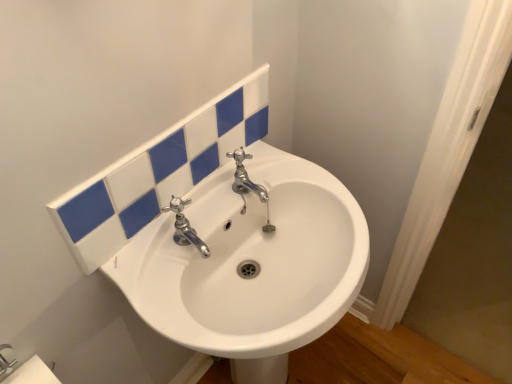
Question: Considering the relative positions of chrome/metallic faucet at center and white matte toilet paper at lower left in the image provided, is chrome/metallic faucet at center behind white matte toilet paper at lower left?

Choices:
 (A) no
 (B) yes

Answer: (B)

Question: Considering the relative sizes of chrome/metallic faucet at center and white matte toilet paper at lower left in the image provided, is chrome/metallic faucet at center smaller than white matte toilet paper at lower left?

Choices:
 (A) yes
 (B) no

Answer: (A)

Question: From the image's perspective, is chrome/metallic faucet at center over white matte toilet paper at lower left?

Choices:
 (A) no
 (B) yes

Answer: (B)

Question: Is chrome/metallic faucet at center positioned far away from white matte toilet paper at lower left?

Choices:
 (A) yes
 (B) no

Answer: (B)

Question: Does chrome/metallic faucet at center have a greater width compared to white matte toilet paper at lower left?

Choices:
 (A) yes
 (B) no

Answer: (A)

Question: Does point (181, 266) appear closer or farther from the camera than point (245, 145)?

Choices:
 (A) farther
 (B) closer

Answer: (B)

Question: Looking at the image, does white glossy sink at center seem bigger or smaller compared to white glossy tiles at upper center?

Choices:
 (A) small
 (B) big

Answer: (B)

Question: Would you say white glossy sink at center is to the left or to the right of white glossy tiles at upper center in the picture?

Choices:
 (A) left
 (B) right

Answer: (B)

Question: Considering the positions of white glossy sink at center and white glossy tiles at upper center in the image, is white glossy sink at center taller or shorter than white glossy tiles at upper center?

Choices:
 (A) short
 (B) tall

Answer: (B)

Question: In the image, is white matte toilet paper at lower left on the left side or the right side of white glossy sink at center?

Choices:
 (A) left
 (B) right

Answer: (A)

Question: From a real-world perspective, is white matte toilet paper at lower left physically located above or below white glossy sink at center?

Choices:
 (A) below
 (B) above

Answer: (B)

Question: From the image's perspective, is white matte toilet paper at lower left located above or below white glossy sink at center?

Choices:
 (A) above
 (B) below

Answer: (A)

Question: Considering the positions of point (15, 380) and point (173, 211), is point (15, 380) closer or farther from the camera than point (173, 211)?

Choices:
 (A) closer
 (B) farther

Answer: (A)

Question: Which is correct: white glossy sink at center is inside chrome/metallic faucet at center, or outside of it?

Choices:
 (A) inside
 (B) outside

Answer: (B)

Question: From the image's perspective, is white glossy sink at center above or below chrome/metallic faucet at center?

Choices:
 (A) below
 (B) above

Answer: (A)